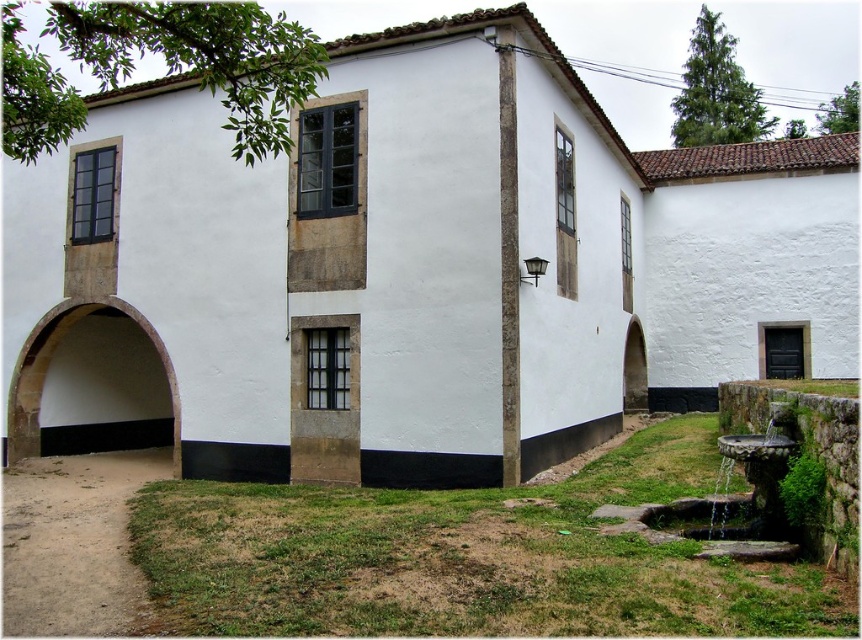
Question: Which point is farther from the camera taking this photo?

Choices:
 (A) (628, 324)
 (B) (44, 340)

Answer: (A)

Question: Which point is closer to the camera?

Choices:
 (A) brown stone archway at lower left
 (B) white stone archway at right

Answer: (A)

Question: Does brown stone archway at lower left appear over white stone archway at right?

Choices:
 (A) no
 (B) yes

Answer: (B)

Question: Is brown stone archway at lower left wider than white stone archway at right?

Choices:
 (A) yes
 (B) no

Answer: (A)

Question: Among these points, which one is nearest to the camera?

Choices:
 (A) (169, 401)
 (B) (622, 381)

Answer: (B)

Question: Is brown stone archway at lower left below white stone archway at right?

Choices:
 (A) yes
 (B) no

Answer: (B)